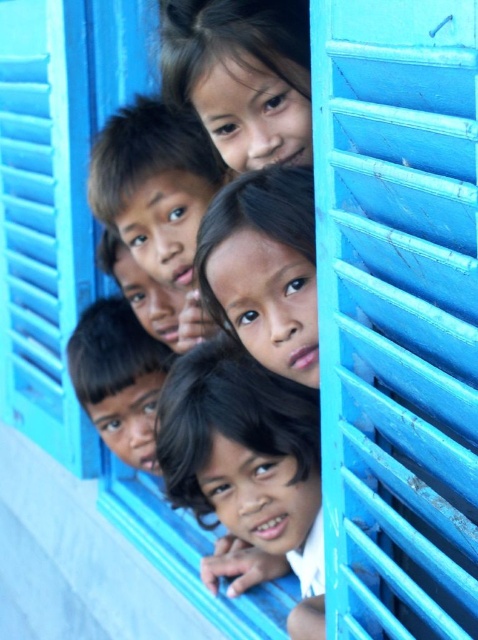
You are standing in front of the blue window and want to touch the two points on the window. Which point, point (476, 632) or point (237, 490), is easier to reach without moving your hand?

Point (476, 632) is closer to the camera than point (237, 490), so it is easier to reach without moving your hand.

In the scene with the bright blue window, there are two children with dark brown hair at center and matte black hair at upper center. Which child has hair that appears wider?

The dark brown hair at center might be wider than matte black hair at upper center.